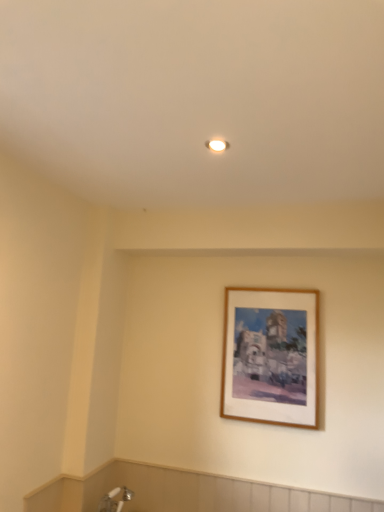
The image size is (384, 512). What are the coordinates of `wooden picture frame at upper center` in the screenshot? It's located at (271, 356).

What do you see at coordinates (271, 356) in the screenshot? I see `wooden picture frame at upper center` at bounding box center [271, 356].

The width and height of the screenshot is (384, 512). I want to click on wooden picture frame at upper center, so click(x=271, y=356).